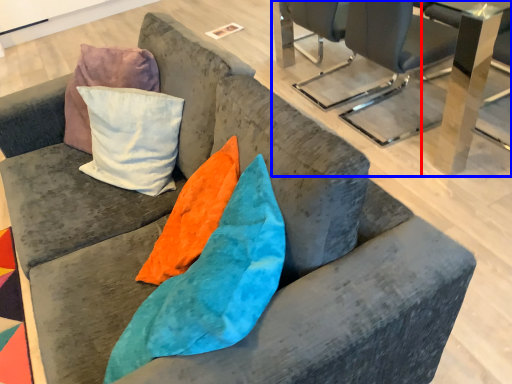
Question: Which point is closer to the camera, table (highlighted by a red box) or table (highlighted by a blue box)?

Choices:
 (A) table
 (B) table

Answer: (B)